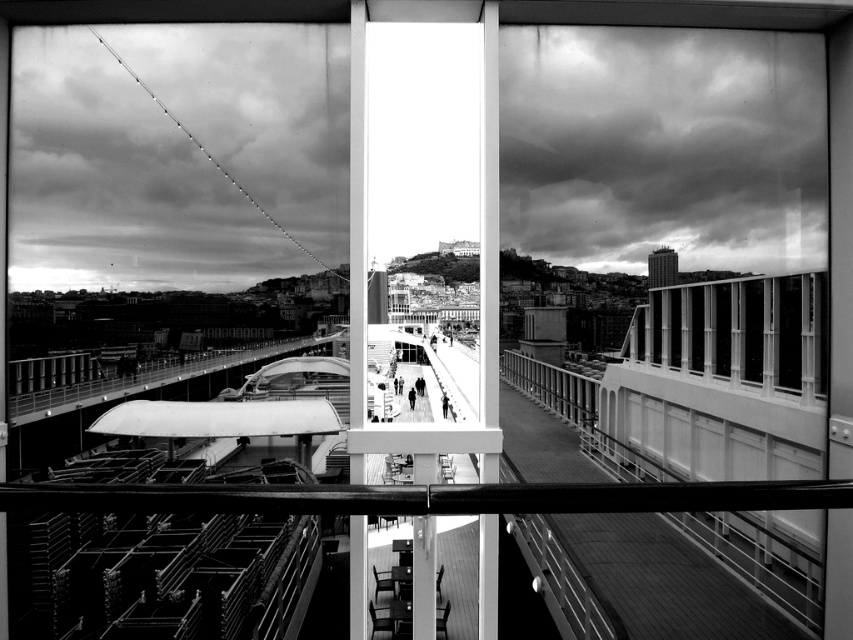
Between metallic glass windows at right and silhouette figure at center, which one appears on the right side from the viewer's perspective?

From the viewer's perspective, metallic glass windows at right appears more on the right side.

Measure the distance between metallic glass windows at right and camera.

The distance of metallic glass windows at right from camera is 98.18 meters.

Is point (653, 310) closer to viewer compared to point (408, 392)?

Yes, point (653, 310) is closer to viewer.

You are a GUI agent. You are given a task and a screenshot of the screen. Output one action in this format:
    pyautogui.click(x=<x>, y=<y>)
    Task: Click on the metallic glass windows at right
    This screenshot has width=853, height=640.
    Given the screenshot: What is the action you would take?
    pyautogui.click(x=740, y=332)